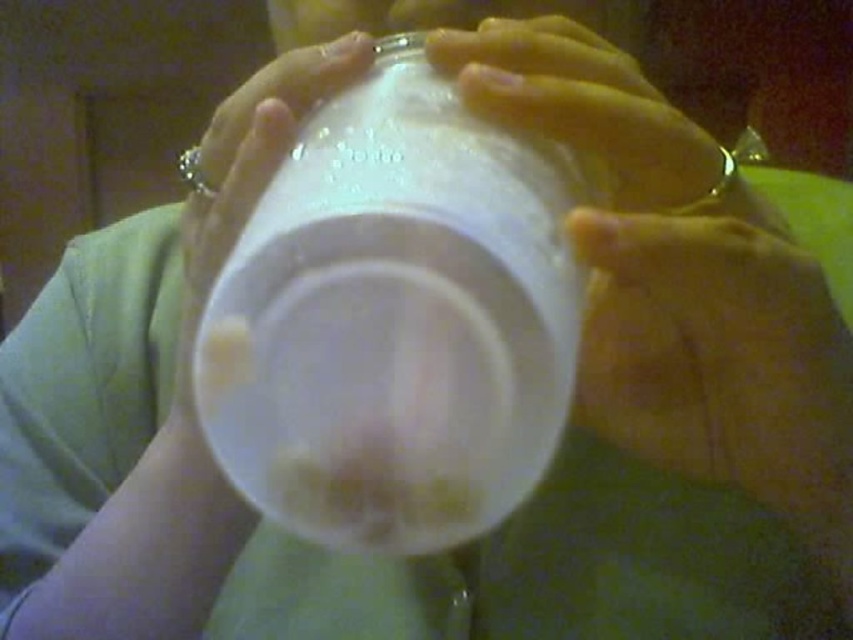
Is translucent plastic cup at center positioned at the back of yellow fabric at lower right?

No, translucent plastic cup at center is closer to the viewer.

Locate an element on the screen. This screenshot has height=640, width=853. translucent plastic cup at center is located at coordinates (395, 321).

The image size is (853, 640). Describe the element at coordinates (395, 321) in the screenshot. I see `translucent plastic cup at center` at that location.

Where is `translucent plastic cup at center`? The width and height of the screenshot is (853, 640). translucent plastic cup at center is located at coordinates (395, 321).